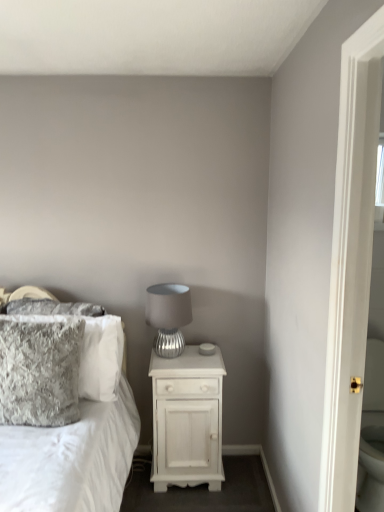
Question: From the image's perspective, would you say white fluffy pillow at left is shown under white wood nightstand at center?

Choices:
 (A) yes
 (B) no

Answer: (B)

Question: From a real-world perspective, is white fluffy pillow at left over white wood nightstand at center?

Choices:
 (A) yes
 (B) no

Answer: (A)

Question: Does white fluffy pillow at left appear on the right side of white wood nightstand at center?

Choices:
 (A) yes
 (B) no

Answer: (B)

Question: Can you confirm if white fluffy pillow at left is positioned to the left of white wood nightstand at center?

Choices:
 (A) no
 (B) yes

Answer: (B)

Question: Considering the relative sizes of white fluffy pillow at left and white wood nightstand at center in the image provided, is white fluffy pillow at left wider than white wood nightstand at center?

Choices:
 (A) no
 (B) yes

Answer: (B)

Question: Is white fluffy pillow at left turned away from white wood nightstand at center?

Choices:
 (A) yes
 (B) no

Answer: (B)

Question: Considering the relative positions of white fluffy pillow at left and fuzzy gray pillow at left, the 2th pillow from the back, in the image provided, is white fluffy pillow at left to the left of fuzzy gray pillow at left, the 2th pillow from the back, from the viewer's perspective?

Choices:
 (A) yes
 (B) no

Answer: (A)

Question: Would you consider white fluffy pillow at left to be distant from fuzzy gray pillow at left, the 2th pillow from the back?

Choices:
 (A) no
 (B) yes

Answer: (A)

Question: Is white fluffy pillow at left touching fuzzy gray pillow at left, which is counted as the 1th pillow, starting from the front?

Choices:
 (A) no
 (B) yes

Answer: (A)

Question: Is white fluffy pillow at left taller than fuzzy gray pillow at left, which is counted as the 1th pillow, starting from the front?

Choices:
 (A) yes
 (B) no

Answer: (A)

Question: Does white fluffy pillow at left have a lesser width compared to fuzzy gray pillow at left, which is counted as the 1th pillow, starting from the front?

Choices:
 (A) no
 (B) yes

Answer: (A)

Question: Can you confirm if white fluffy pillow at left is positioned to the right of fuzzy gray pillow at left, the 2th pillow from the back?

Choices:
 (A) yes
 (B) no

Answer: (B)

Question: From a real-world perspective, is velvety gray pillow at left, the first pillow in the back-to-front sequence, located higher than white fluffy pillow at left?

Choices:
 (A) yes
 (B) no

Answer: (A)